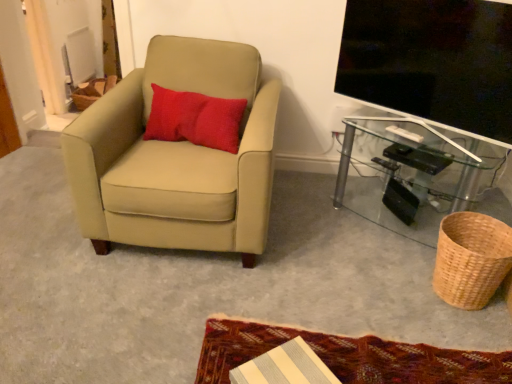
Where is `free space between transparent glass table at lower right and woven natural basket at lower right`? The width and height of the screenshot is (512, 384). free space between transparent glass table at lower right and woven natural basket at lower right is located at coordinates (384, 251).